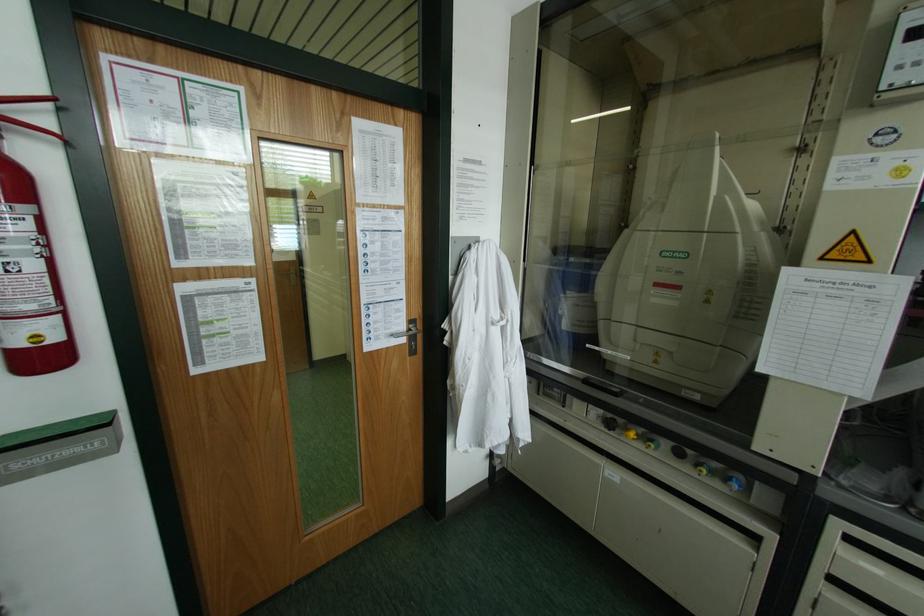
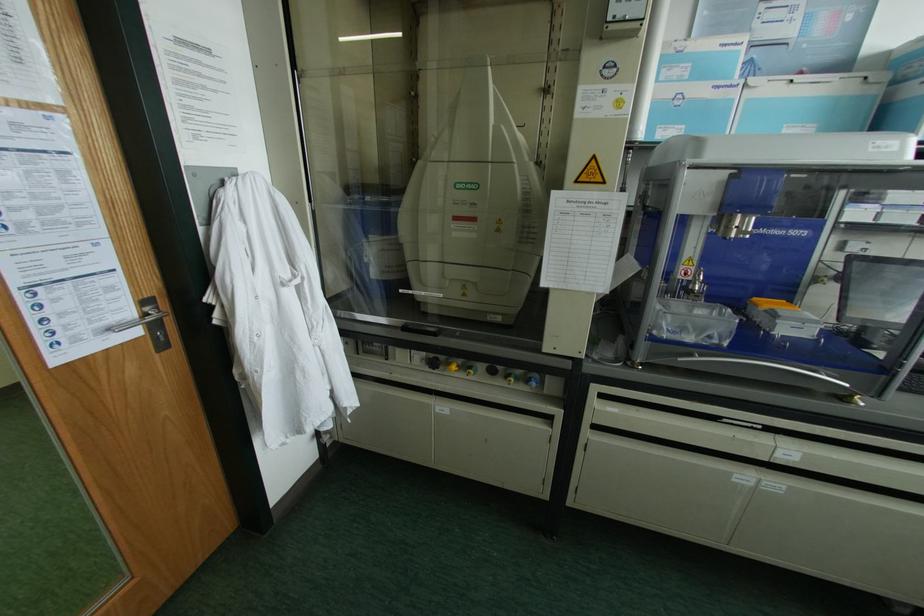
In the second image, find the point that corresponds to [740,477] in the first image.

(536, 376)